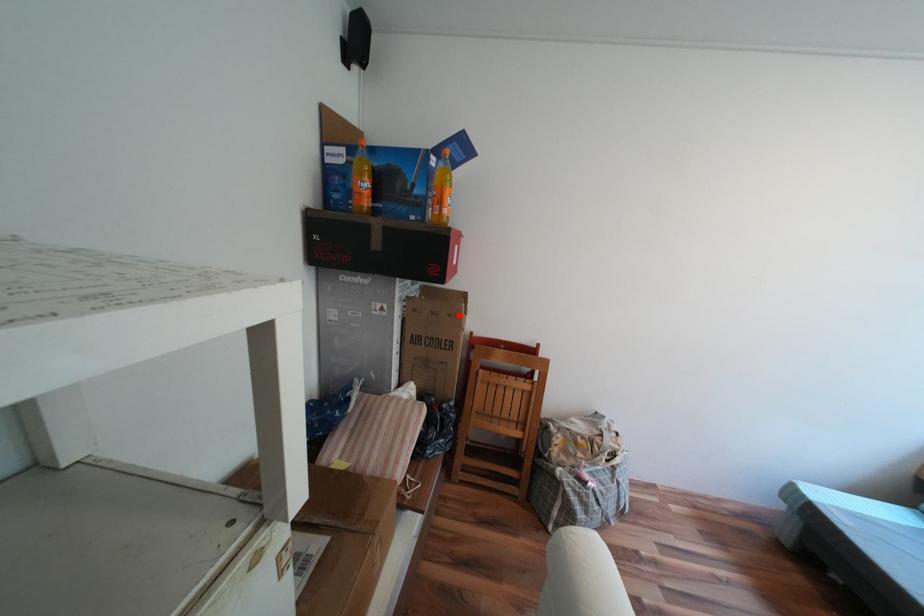
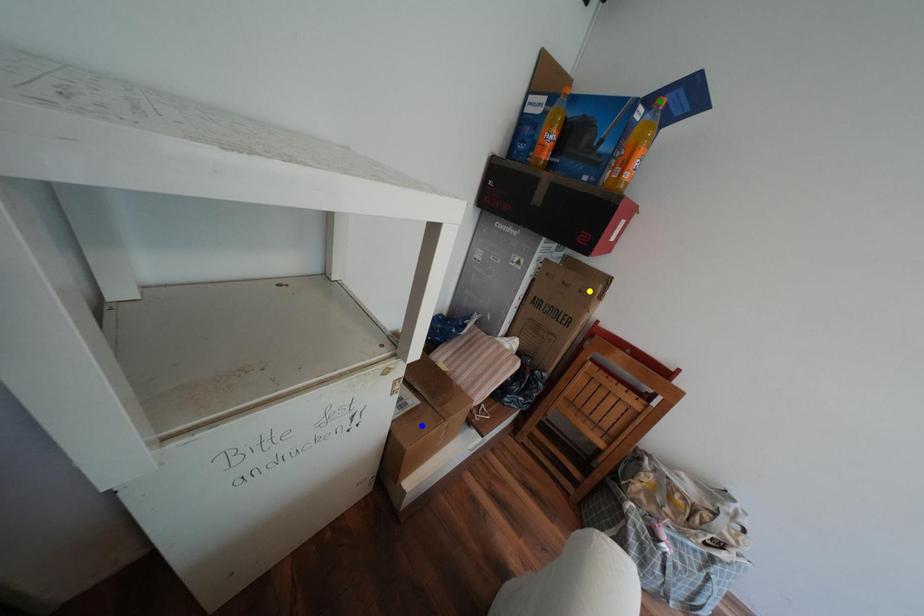
Question: I am providing you with two images of the same scene from different viewpoints. A red point is marked on the first image. You are given multiple points on the second image. Can you choose the point in image 2 that corresponds to the point in image 1?

Choices:
 (A) yellow point
 (B) blue point
 (C) green point

Answer: (A)